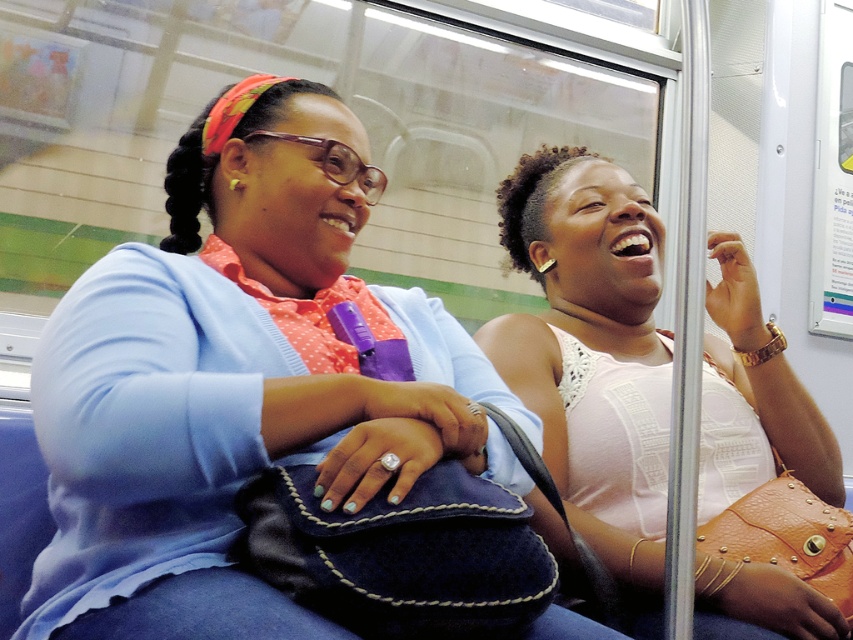
Between matte blue sweater at center and pink lace top at right, which one has more height?

pink lace top at right is taller.

Which is more to the right, matte blue sweater at center or pink lace top at right?

pink lace top at right

The image size is (853, 640). Identify the location of matte blue sweater at center. 238,381.